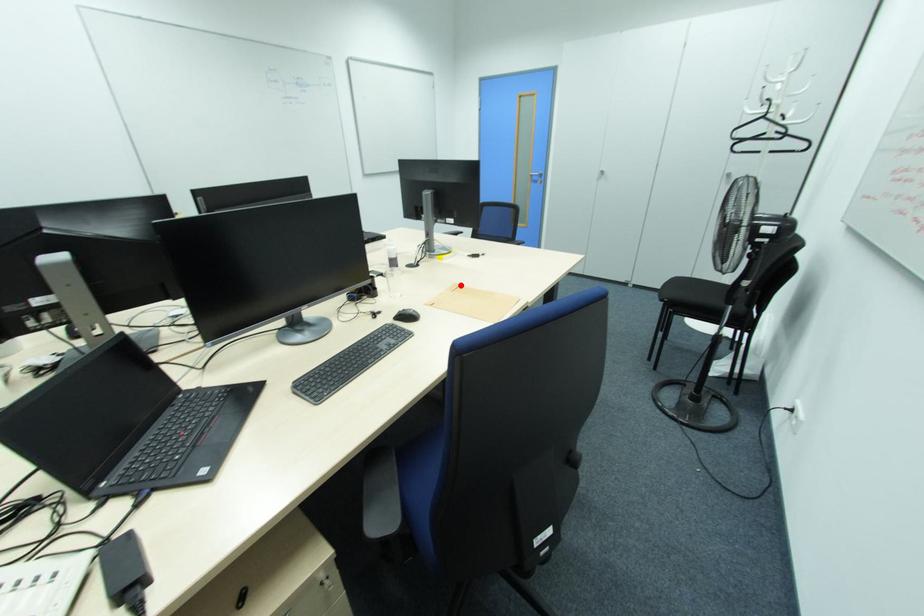
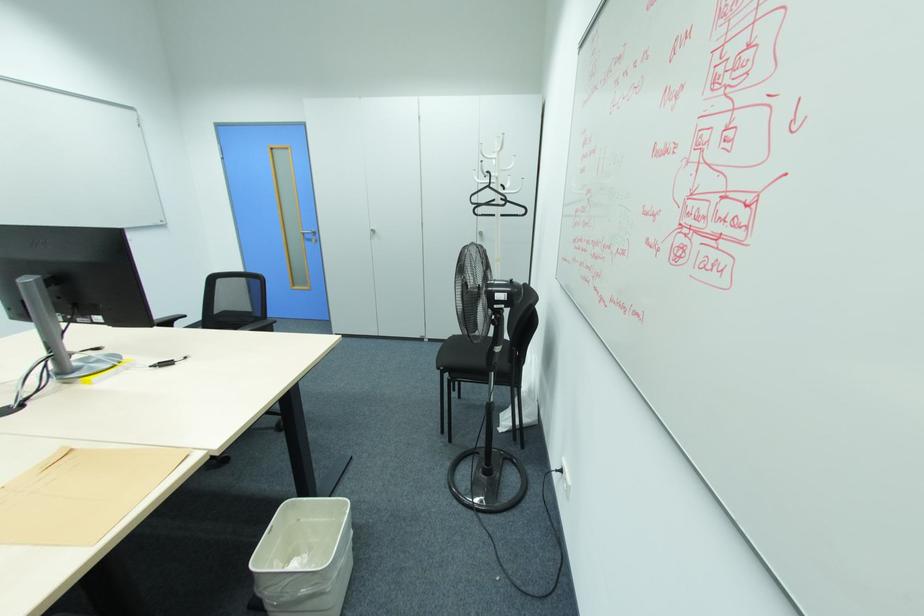
Locate, in the second image, the point that corresponds to the highlighted location in the first image.

(78, 448)